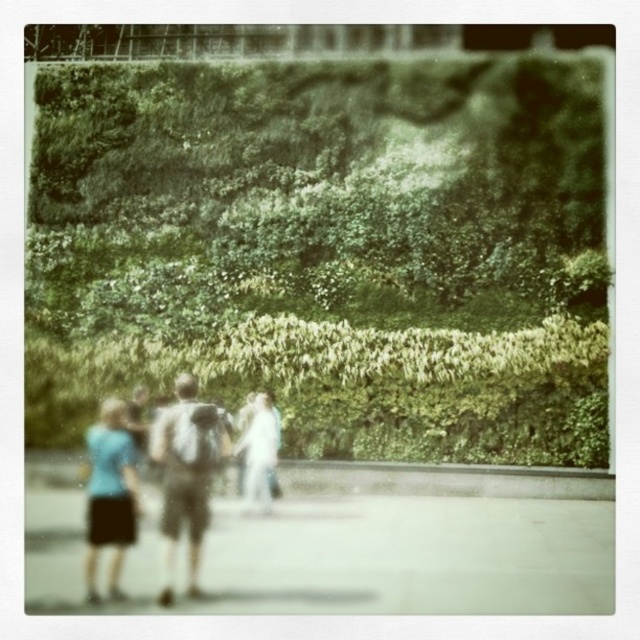
Question: Does green leafy hedge at upper center lie behind gray concrete pavement at lower center?

Choices:
 (A) yes
 (B) no

Answer: (A)

Question: Does green leafy hedge at upper center appear on the left side of gray fabric backpack at center?

Choices:
 (A) no
 (B) yes

Answer: (A)

Question: Which of the following is the closest to the observer?

Choices:
 (A) (492, 170)
 (B) (164, 531)
 (C) (108, 492)

Answer: (C)

Question: Can you confirm if green leafy hedge at upper center is bigger than gray fabric backpack at center?

Choices:
 (A) yes
 (B) no

Answer: (A)

Question: Which object is positioned closest to the gray concrete pavement at lower center?

Choices:
 (A) light blue fabric skirt at lower left
 (B) gray fabric backpack at center
 (C) light blue fabric couple at center

Answer: (B)

Question: Among these points, which one is nearest to the camera?

Choices:
 (A) (317, 586)
 (B) (118, 589)
 (C) (176, 387)
 (D) (84, 568)

Answer: (B)